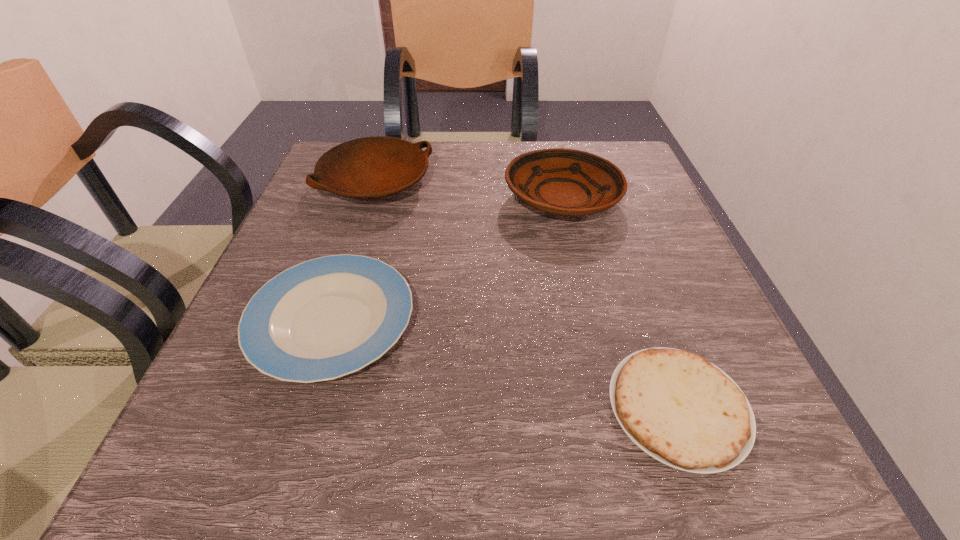
Image resolution: width=960 pixels, height=540 pixels. In order to click on the rightmost plate in this screenshot , I will do (x=567, y=182).

I want to click on the shortest plate, so click(x=328, y=317).

At what (x,y) coordinates should I click in order to perform the action: click on the shortest object. Please return your answer as a coordinate pair (x, y). The height and width of the screenshot is (540, 960). Looking at the image, I should click on (684, 411).

At what (x,y) coordinates should I click in order to perform the action: click on free space located on the left of the rightmost plate. Please return your answer as a coordinate pair (x, y). The image size is (960, 540). Looking at the image, I should click on (444, 198).

I want to click on free point located 0.140m on the right of the nearest plate, so click(x=503, y=323).

The height and width of the screenshot is (540, 960). Find the location of `free spot located 0.050m on the back of the shortest object`. free spot located 0.050m on the back of the shortest object is located at coordinates (649, 326).

This screenshot has height=540, width=960. In order to click on object that is positioned at the near edge in this screenshot , I will do `click(684, 411)`.

What are the coordinates of `plate that is at the right edge` in the screenshot? It's located at coord(567,182).

I want to click on tortilla at the right edge, so click(x=684, y=411).

Find the location of `object that is positioned at the far left corner`. object that is positioned at the far left corner is located at coordinates pyautogui.click(x=370, y=167).